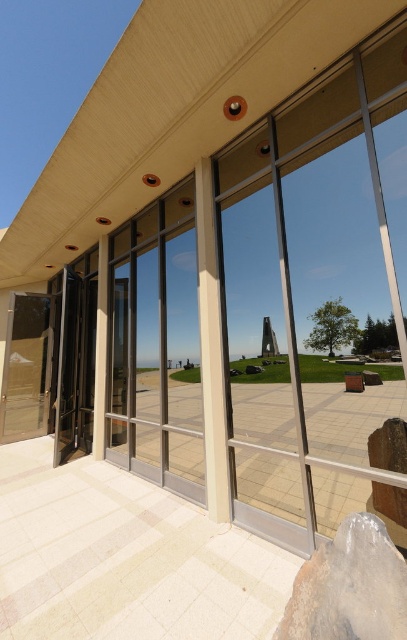
You are a window installer assessing the modern building. You need to replace the clear glass window at center and the clear glass pillar at center. Which object requires a wider replacement panel?

The clear glass window at center requires a wider replacement panel because its width surpasses that of the clear glass pillar at center.

You are standing in front of the modern building and want to take a photo of the clear glass window at center. Where should you position yourself to capture the window in the center of your camera frame?

Position yourself directly in front of the clear glass window at center, as its 2D location is at point (x=157, y=346), which is near the center of the image.

You are a delivery person trying to enter the building through the black glass door at left. You have a large box that is 1.2 meters wide. Can you fit the box through the door if the door is wider than the white glossy pillar at center?

The black glass door at left might be wider than the white glossy pillar at center. Since the pillar is not mentioned to be a specific width, we cannot confirm if the door is wide enough for the 1.2 meter box. Please check the actual dimensions before attempting to move the box through.